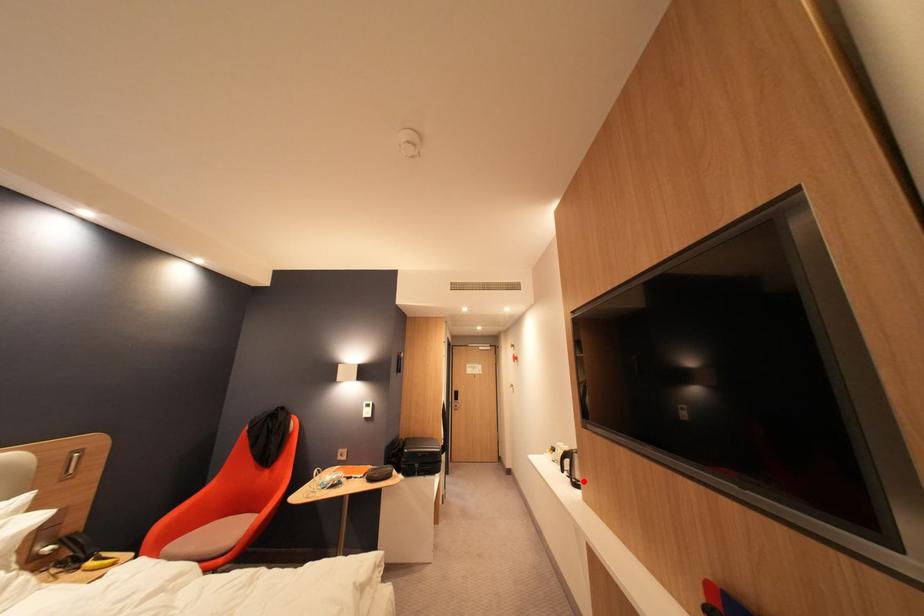
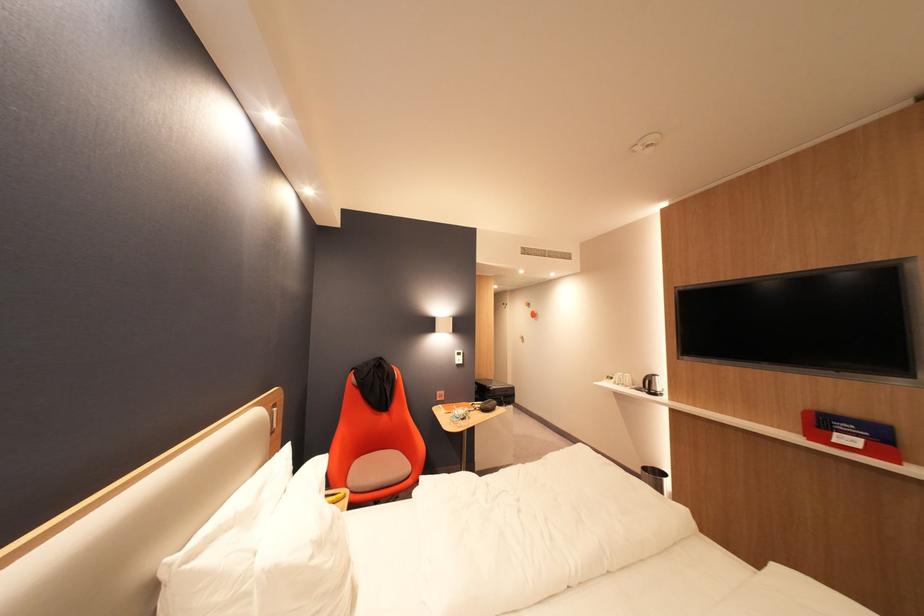
Locate, in the second image, the point that corresponds to the highlighted location in the first image.

(662, 392)